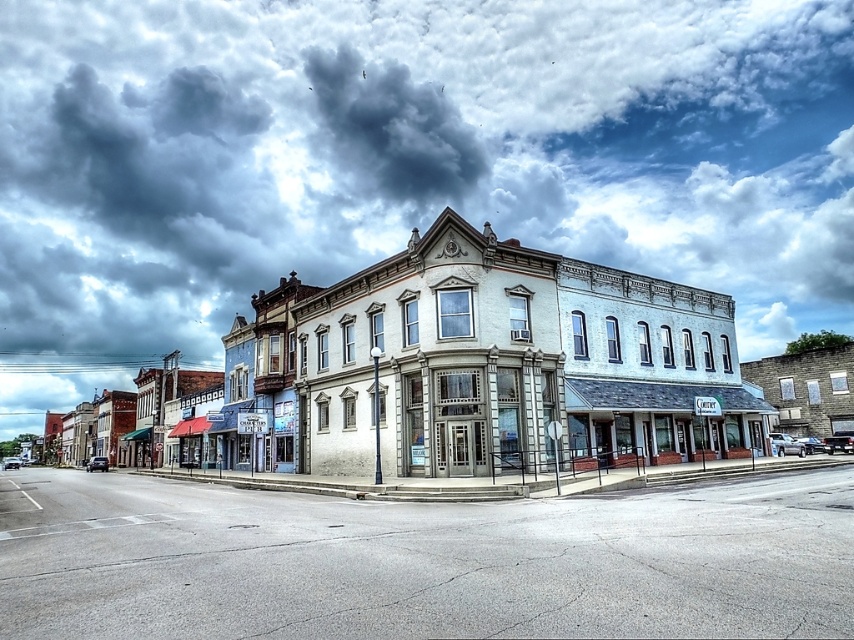
You are standing at the street corner and want to look up at the cloudy sky at upper center. What direction should you face?

Since the cloudy sky at upper center is located at point (402, 160), you should face upwards to look at it.

You are standing on the street looking at the white stone building at center. Which direction should you turn your head to see the cloudy sky at upper center?

You should turn your head to the right to see the cloudy sky at upper center because it is located to the right of the white stone building at center.

You are standing at the point with coordinates point (615,348) and want to walk to the point with coordinates point (576,568). Which direction should you move relative to your current position?

You should move forward because point (576,568) is in front of point (615,348).